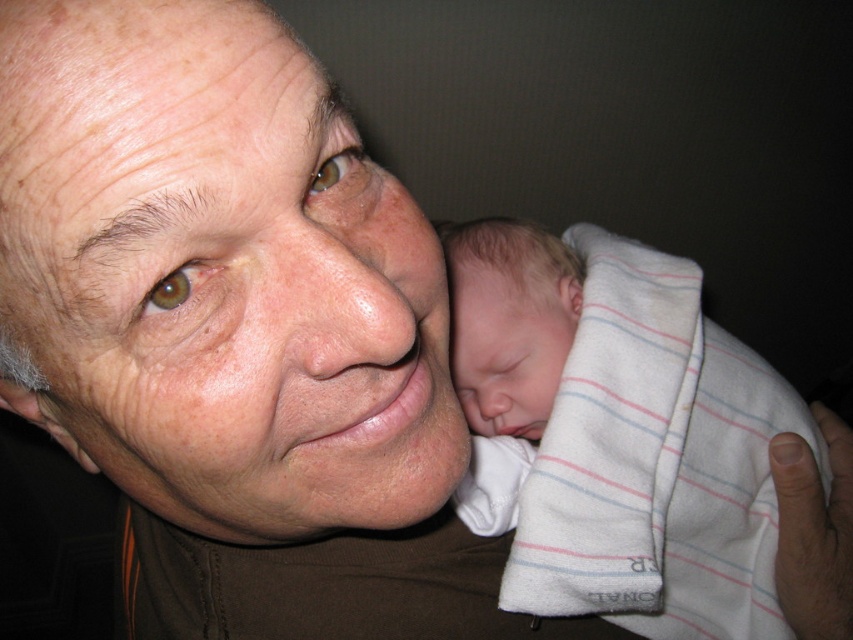
Question: Which of the following is the farthest from the observer?

Choices:
 (A) soft white blanket at right
 (B) smooth skin face at center

Answer: (A)

Question: In this image, where is smooth skin face at center located relative to soft white blanket at right?

Choices:
 (A) left
 (B) right

Answer: (A)

Question: Can you confirm if smooth skin face at center is positioned to the right of soft white blanket at right?

Choices:
 (A) yes
 (B) no

Answer: (B)

Question: Is smooth skin face at center bigger than soft white blanket at right?

Choices:
 (A) yes
 (B) no

Answer: (B)